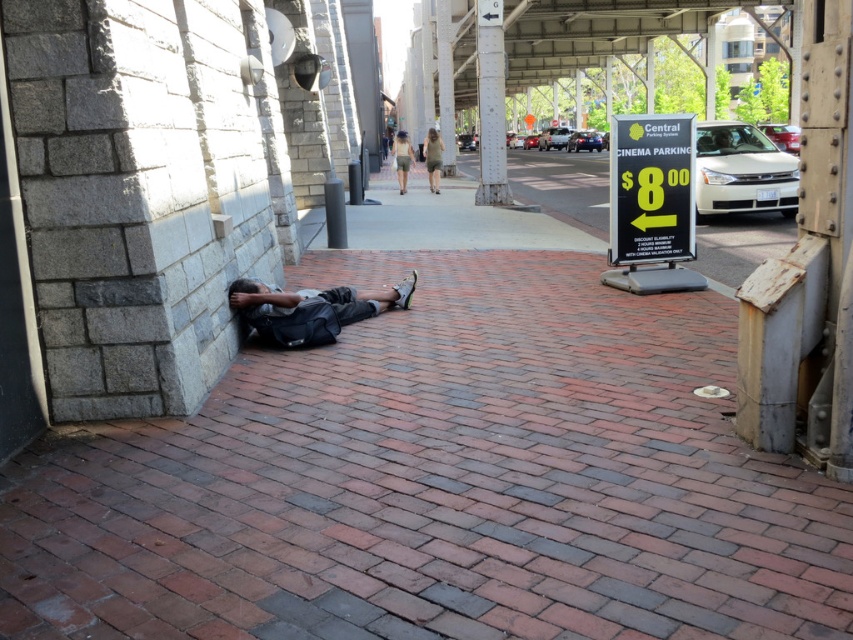
Consider the image. Is white painted metal pole at upper center below khaki shorts at center?

Correct, white painted metal pole at upper center is located below khaki shorts at center.

Is point (503, 132) closer to viewer compared to point (404, 141)?

Yes, point (503, 132) is in front of point (404, 141).

Between point (505, 204) and point (404, 170), which one is positioned in front?

Point (505, 204) is in front.

What are the coordinates of `white painted metal pole at upper center` in the screenshot? It's located at (490, 106).

Can you confirm if white painted metal pole at upper center is positioned to the right of matte gray dress at center?

Yes, white painted metal pole at upper center is to the right of matte gray dress at center.

How distant is white painted metal pole at upper center from matte gray dress at center?

They are 13.38 feet apart.

Is point (483, 84) in front of point (432, 157)?

Yes, it is.

At what (x,y) coordinates should I click in order to perform the action: click on white painted metal pole at upper center. Please return your answer as a coordinate pair (x, y). Looking at the image, I should click on (490, 106).

Is dark gray fabric bag at center above white painted metal pole at upper center?

Incorrect, dark gray fabric bag at center is not positioned above white painted metal pole at upper center.

Who is positioned more to the left, dark gray fabric bag at center or white painted metal pole at upper center?

From the viewer's perspective, dark gray fabric bag at center appears more on the left side.

Which is in front, point (258, 321) or point (482, 88)?

Point (258, 321)

Locate an element on the screen. The width and height of the screenshot is (853, 640). dark gray fabric bag at center is located at coordinates (311, 308).